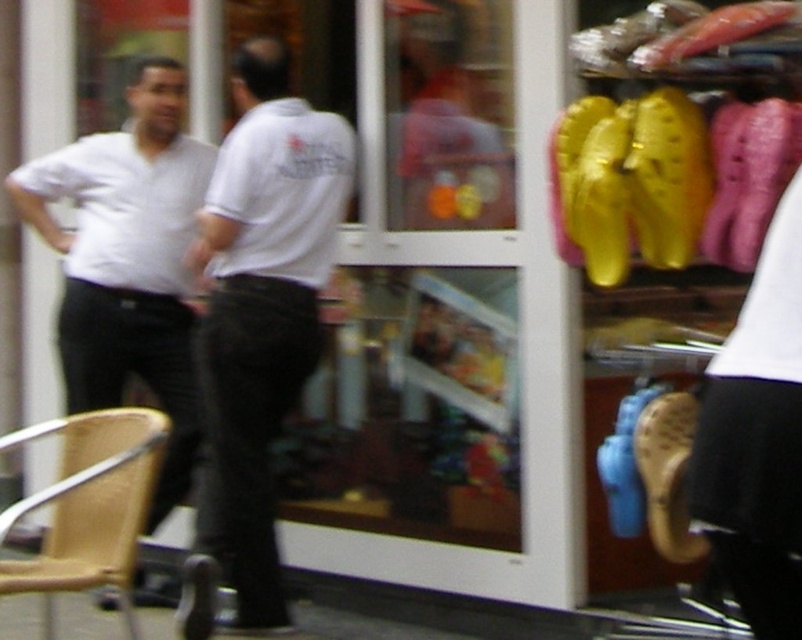
You are a delivery person trying to enter the shop through the door. The white matte shirt at left and the wooden chair at lower left are blocking your path. Which object should you move to have enough space to pass through?

The wooden chair at lower left should be moved because it is narrower than the white matte shirt at left, so moving the narrower object would allow more space for the delivery person to pass through.